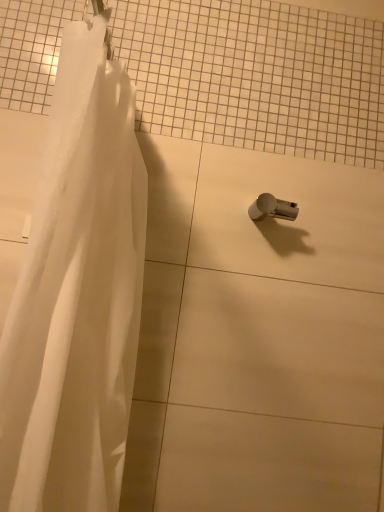
Measure the distance between silver metallic tap at center and camera.

The distance of silver metallic tap at center from camera is 39.13 inches.

This screenshot has height=512, width=384. Describe the element at coordinates (272, 208) in the screenshot. I see `silver metallic tap at center` at that location.

The image size is (384, 512). In order to click on silver metallic tap at center in this screenshot , I will do `click(272, 208)`.

The width and height of the screenshot is (384, 512). Find the location of `silver metallic tap at center`. silver metallic tap at center is located at coordinates (272, 208).